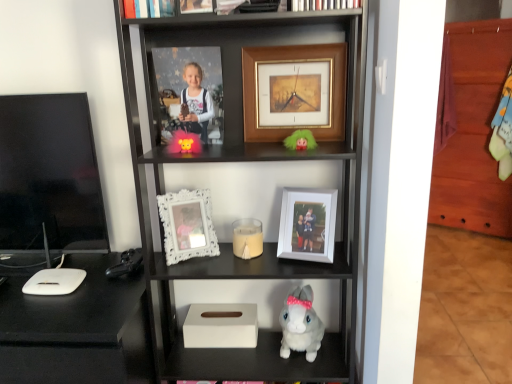
Question: Are white matte candle at center and white matte picture frame at center, the 5th picture frame positioned from the top, beside each other?

Choices:
 (A) yes
 (B) no

Answer: (B)

Question: Considering the relative sizes of white matte candle at center and white matte picture frame at center, the 1th picture frame positioned from the bottom, in the image provided, is white matte candle at center taller than white matte picture frame at center, the 1th picture frame positioned from the bottom,?

Choices:
 (A) no
 (B) yes

Answer: (A)

Question: Is white matte candle at center to the left of white matte picture frame at center, the 5th picture frame positioned from the top, from the viewer's perspective?

Choices:
 (A) no
 (B) yes

Answer: (B)

Question: Can you confirm if white matte candle at center is thinner than white matte picture frame at center, the 1th picture frame positioned from the bottom?

Choices:
 (A) yes
 (B) no

Answer: (B)

Question: Is white matte candle at center aimed at white matte picture frame at center, the 1th picture frame positioned from the bottom?

Choices:
 (A) yes
 (B) no

Answer: (B)

Question: Is point (188, 9) positioned closer to the camera than point (321, 6)?

Choices:
 (A) closer
 (B) farther

Answer: (B)

Question: Is wooden photo frame at upper center, which is counted as the 5th picture frame, starting from the bottom, taller or shorter than white matte bookshelf at upper center, which appears as the 1th book when viewed from the right?

Choices:
 (A) tall
 (B) short

Answer: (B)

Question: Considering their positions, is wooden photo frame at upper center, the first picture frame in the top-to-bottom sequence, located in front of or behind white matte bookshelf at upper center, which appears as the 1th book when viewed from the right?

Choices:
 (A) behind
 (B) front

Answer: (A)

Question: Is wooden photo frame at upper center, the first picture frame in the top-to-bottom sequence, spatially inside white matte bookshelf at upper center, which is counted as the second book, starting from the left, or outside of it?

Choices:
 (A) outside
 (B) inside

Answer: (A)

Question: From a real-world perspective, relative to white matte candle at center, is white matte bookshelf at upper center, which appears as the 1th book when viewed from the right, vertically above or below?

Choices:
 (A) above
 (B) below

Answer: (A)

Question: From the image's perspective, is white matte bookshelf at upper center, which is counted as the second book, starting from the left, positioned above or below white matte candle at center?

Choices:
 (A) above
 (B) below

Answer: (A)

Question: Visually, is white matte bookshelf at upper center, which appears as the 1th book when viewed from the right, positioned to the left or to the right of white matte candle at center?

Choices:
 (A) left
 (B) right

Answer: (B)

Question: Is white matte bookshelf at upper center, which is counted as the second book, starting from the left, inside or outside of white matte candle at center?

Choices:
 (A) inside
 (B) outside

Answer: (B)

Question: From the image's perspective, relative to white matte tissue box at lower center, is shiny orange plush toy at center, marked as the 2th toy in a bottom-to-top arrangement, above or below?

Choices:
 (A) below
 (B) above

Answer: (B)

Question: From a real-world perspective, relative to white matte tissue box at lower center, is shiny orange plush toy at center, marked as the 2th toy in a bottom-to-top arrangement, vertically above or below?

Choices:
 (A) below
 (B) above

Answer: (B)